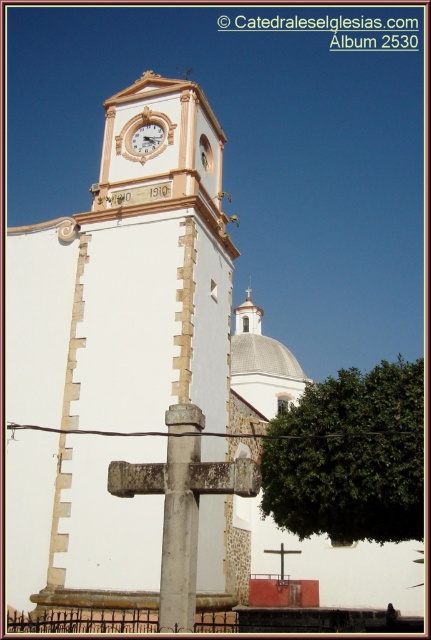
Can you confirm if green leafy tree at center is bigger than white painted wood clock at upper center?

Yes, green leafy tree at center is bigger than white painted wood clock at upper center.

Does green leafy tree at center appear on the left side of white painted wood clock at upper center?

No, green leafy tree at center is not to the left of white painted wood clock at upper center.

Who is more distant from viewer, (415, 445) or (115, 148)?

Positioned behind is point (115, 148).

The width and height of the screenshot is (431, 640). What are the coordinates of `green leafy tree at center` in the screenshot? It's located at (349, 458).

Does point (402, 404) come closer to viewer compared to point (149, 124)?

Yes, point (402, 404) is in front of point (149, 124).

Between green leafy tree at center and white wooden clock at upper center, which one is positioned higher?

white wooden clock at upper center is above.

Is point (364, 461) farther from viewer compared to point (156, 129)?

No, it is not.

Where is `green leafy tree at center`? green leafy tree at center is located at coordinates coord(349,458).

Who is more forward, (171, 138) or (139, 131)?

Positioned in front is point (171, 138).

This screenshot has height=640, width=431. Identify the location of white painted wood clock at upper center. (144, 134).